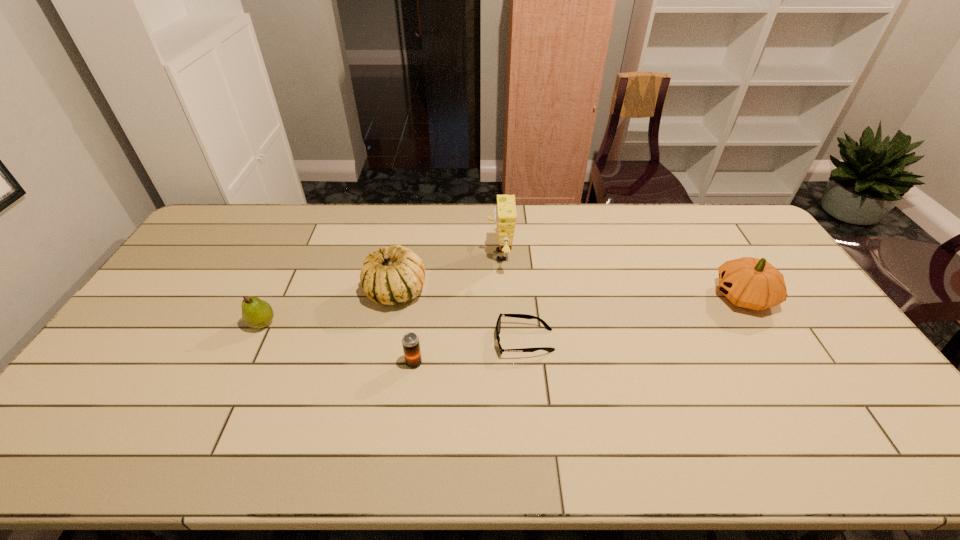
What are the coordinates of `vacant space situated 0.190m on the side of the rightmost object with the carved face` in the screenshot? It's located at (652, 296).

Locate an element on the screen. free region located 0.190m on the side of the rightmost object with the carved face is located at coordinates (652, 296).

At what (x,y) coordinates should I click in order to perform the action: click on free point located on the side of the rightmost object with the carved face. Please return your answer as a coordinate pair (x, y). Looking at the image, I should click on (594, 296).

Find the location of a particular element. This screenshot has height=540, width=960. free spot located on the left of the pear is located at coordinates (198, 323).

Where is `blank area located on the back of the beer can`? The width and height of the screenshot is (960, 540). blank area located on the back of the beer can is located at coordinates click(420, 318).

The image size is (960, 540). Identify the location of free space located 0.060m on the front-facing side of the sunglasses. (474, 341).

Locate an element on the screen. The width and height of the screenshot is (960, 540). free point located 0.290m on the front-facing side of the sunglasses is located at coordinates (394, 341).

What are the coordinates of `vacant space positioned 0.230m on the front-facing side of the sunglasses` in the screenshot? It's located at (415, 341).

This screenshot has height=540, width=960. Identify the location of object present at the far edge. (505, 215).

In order to click on object that is positioned at the right edge in this screenshot , I will do `click(752, 283)`.